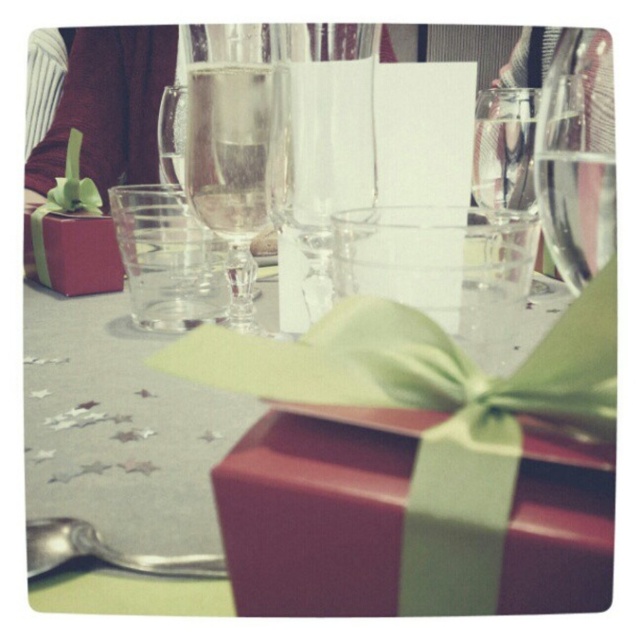
You are arranging a table for a party and notice the matte red gift box at lower left and the transparent glass wine glass at center. Which object is positioned lower on the table?

The matte red gift box at lower left is positioned lower than the transparent glass wine glass at center.

You are setting up a table for a dinner party and need to place a decorative item on the table. You have the matte red gift box at lower left and the shiny silver spoon at lower left. Which object should you choose if you want something that stands out more in height?

The matte red gift box at lower left is much taller than the shiny silver spoon at lower left, so you should choose the matte red gift box at lower left to have something that stands out more in height.